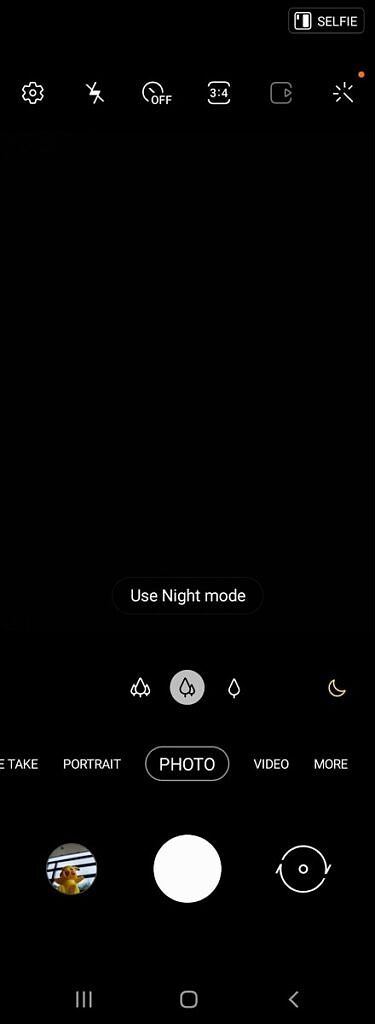
Find the location of `alarm clock`. alarm clock is located at coordinates (337, 93).